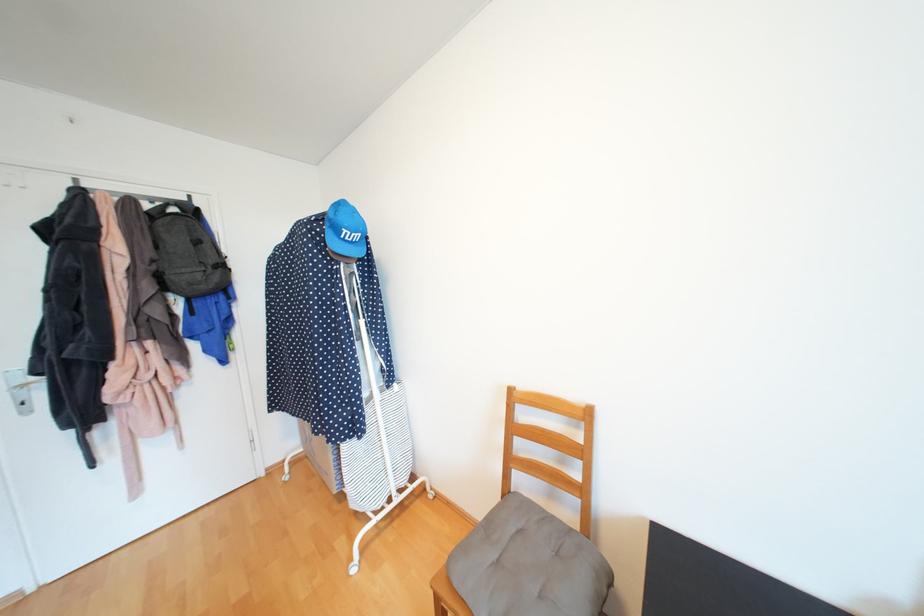
Describe the element at coordinates (528, 565) in the screenshot. I see `a chair sitting surface` at that location.